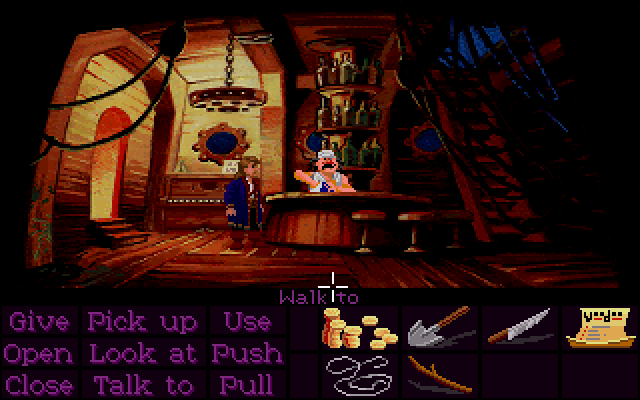
This screenshot has width=640, height=400. I want to click on stools, so click(x=364, y=219), click(x=415, y=221), click(x=452, y=220).